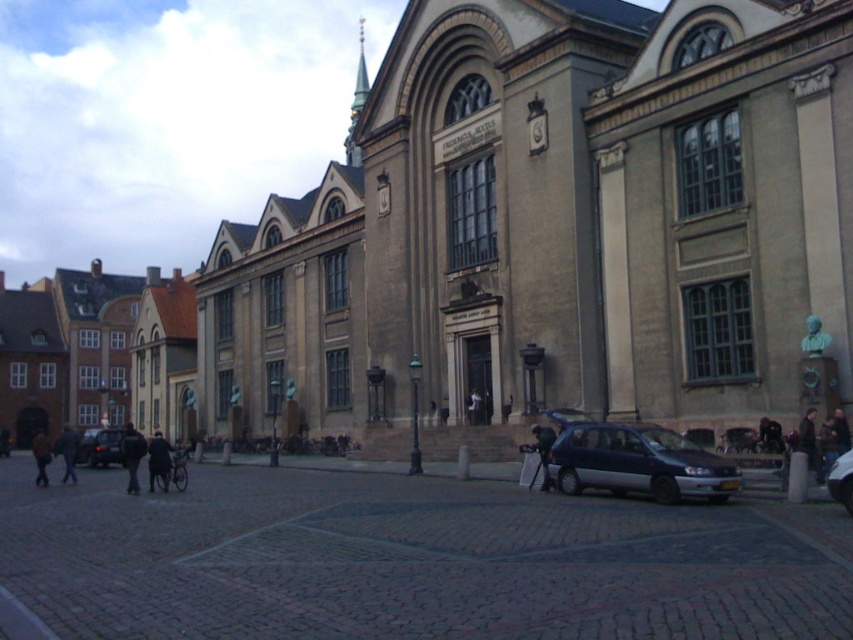
Does satin dark blue hatchback at lower center have a smaller size compared to green fabric jacket at center?

Incorrect, satin dark blue hatchback at lower center is not smaller in size than green fabric jacket at center.

Can you confirm if satin dark blue hatchback at lower center is bigger than green fabric jacket at center?

Correct, satin dark blue hatchback at lower center is larger in size than green fabric jacket at center.

You are a GUI agent. You are given a task and a screenshot of the screen. Output one action in this format:
    pyautogui.click(x=<x>, y=<y>)
    Task: Click on the satin dark blue hatchback at lower center
    
    Given the screenshot: What is the action you would take?
    pyautogui.click(x=637, y=461)

You are a GUI agent. You are given a task and a screenshot of the screen. Output one action in this format:
    pyautogui.click(x=<x>, y=<y>)
    Task: Click on the satin dark blue hatchback at lower center
    
    Given the screenshot: What is the action you would take?
    pyautogui.click(x=637, y=461)

Does green fabric jacket at center have a larger size compared to dark blue jacket at center?

Indeed, green fabric jacket at center has a larger size compared to dark blue jacket at center.

Does point (532, 477) lie behind point (849, 442)?

Yes, it is behind point (849, 442).

This screenshot has width=853, height=640. Find the location of `green fabric jacket at center`. green fabric jacket at center is located at coordinates (543, 451).

Is satin dark blue hatchback at lower center to the left of dark blue jeans at lower left from the viewer's perspective?

No, satin dark blue hatchback at lower center is not to the left of dark blue jeans at lower left.

Between point (718, 500) and point (62, 456), which one is positioned in front?

Point (718, 500)

Is point (720, 493) positioned behind point (74, 449)?

No, (720, 493) is closer to viewer.

The image size is (853, 640). Find the location of `satin dark blue hatchback at lower center`. satin dark blue hatchback at lower center is located at coordinates (637, 461).